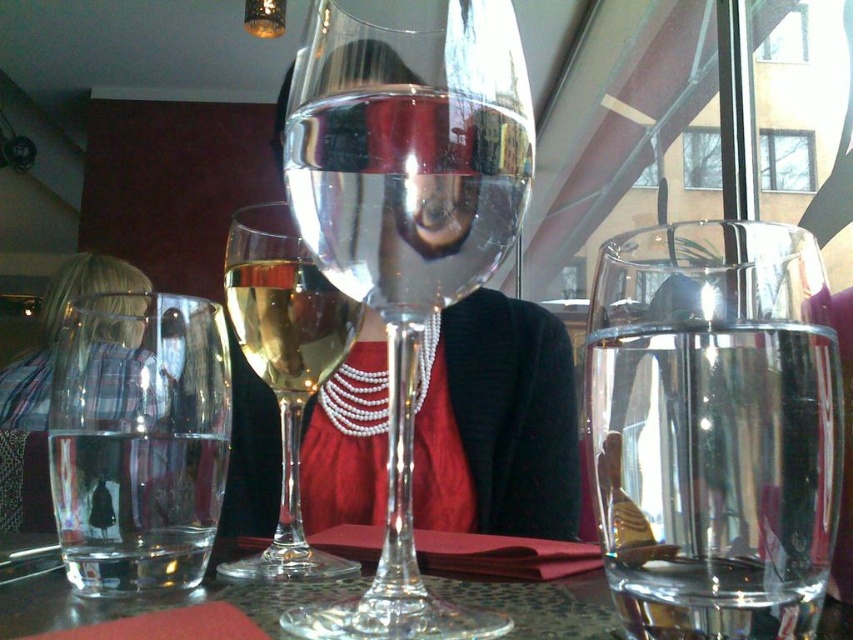
You are a waiter trying to place a new glass on the table. You have two points marked on the table where you can place it. The points are labeled as point 1 at point (376, 164) and point 2 at point (366, 225). Which point is closer to you so that you can easily reach it?

Point 1 at point (376, 164) is closer to the viewer than point 2 at point (366, 225), so you should place the glass there for easier reach.

You are a bartender preparing drinks for a customer. You have two glasses in front of you on the table. One is the translucent glass wine glass at center and the other is the clear glass water at center. Which glass should you use if you need a taller glass to serve a cocktail?

The translucent glass wine glass at center is taller than the clear glass water at center, so you should use the translucent glass wine glass at center to serve the cocktail.

You are a waiter at the restaurant. You need to place a napkin between the transparent glass wine glass at center and the translucent glass wine glass at center. Is this possible given their positions?

The transparent glass wine glass at center is above the translucent glass wine glass at center, so placing a napkin between them is not possible as they are stacked vertically rather than placed side by side.